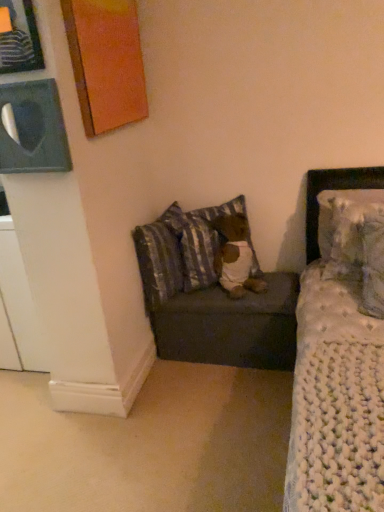
I want to click on free point in front of dark gray fabric ottoman at center, so click(x=220, y=410).